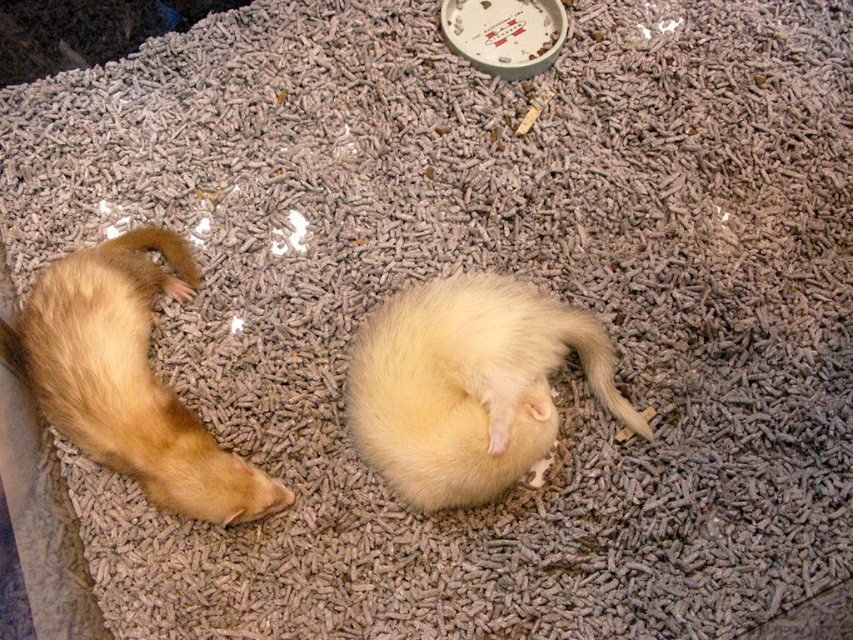
You are observing two ferrets in an enclosure. The fluffy white ferret at center and the golden fur ferret at left are both on the bedding. Which ferret is positioned more to the right side of the enclosure?

The fluffy white ferret at center is positioned more to the right side of the enclosure compared to the golden fur ferret at left.

You are a veterinarian examining an enclosure with two ferrets. You notice the golden fur ferret at left and the yellow fur at lower center. Which ferret is positioned lower in the enclosure?

The golden fur ferret at left is located below the yellow fur at lower center, so the golden fur ferret at left is positioned lower in the enclosure.

From the picture: You are a pet owner who wants to check on your ferrets. You see the fluffy white ferret at center and the yellow fur at lower center. Which ferret is closer to you?

The fluffy white ferret at center is closer to you because it is in front of the yellow fur at lower center.